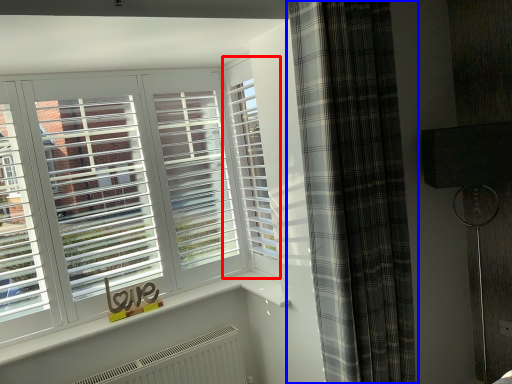
Question: Among these objects, which one is farthest to the camera, window (highlighted by a red box) or curtain (highlighted by a blue box)?

Choices:
 (A) window
 (B) curtain

Answer: (A)